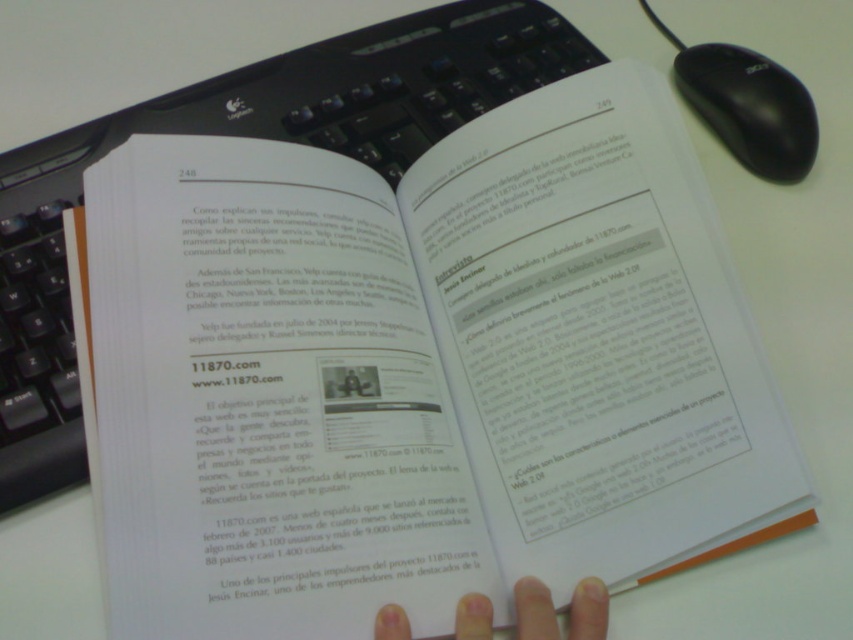
You are a user trying to click on a link on the open book. The black matte mouse at upper right and the white matte finger at lower center are both in your view. Which object is taller and would require you to move your hand higher to reach?

The black matte mouse at upper right is taller than the white matte finger at lower center, so you would need to move your hand higher to reach the black matte mouse at upper right.

You are trying to reach the black matte mouse at upper right on the desk. The book is open to pages 248 and 249. Can you tell me where the point at coordinate (750, 108) is located relative to the book?

The point at coordinate (750, 108) corresponds to the black matte mouse at upper right, which is located to the upper right of the open book on the desk.

You are a student working on a project about 11870.com. You need to click the mouse to save your work. Where should you move your hand to reach the black matte mouse at upper right?

The black matte mouse at upper right is located at point (750, 108), so you should move your hand to that coordinate to reach it.